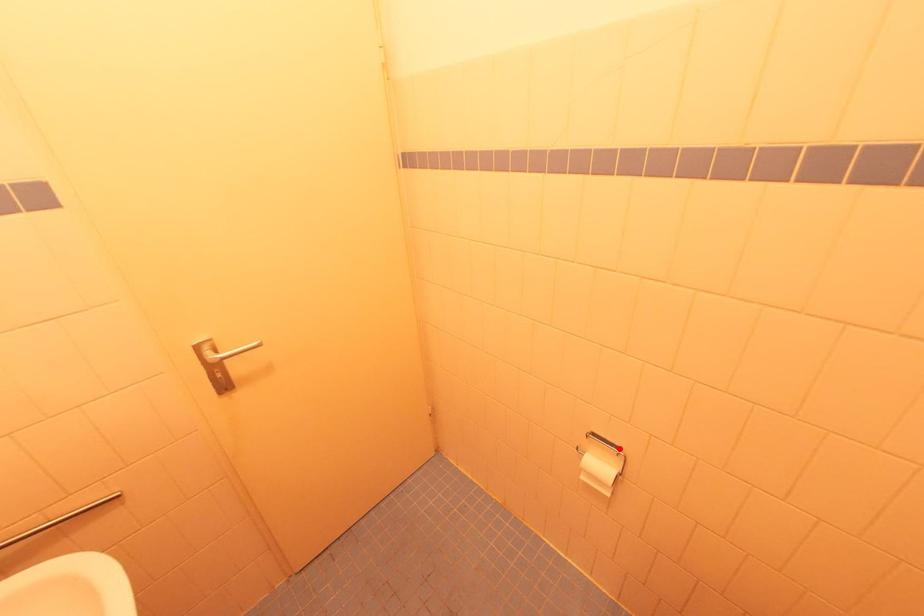
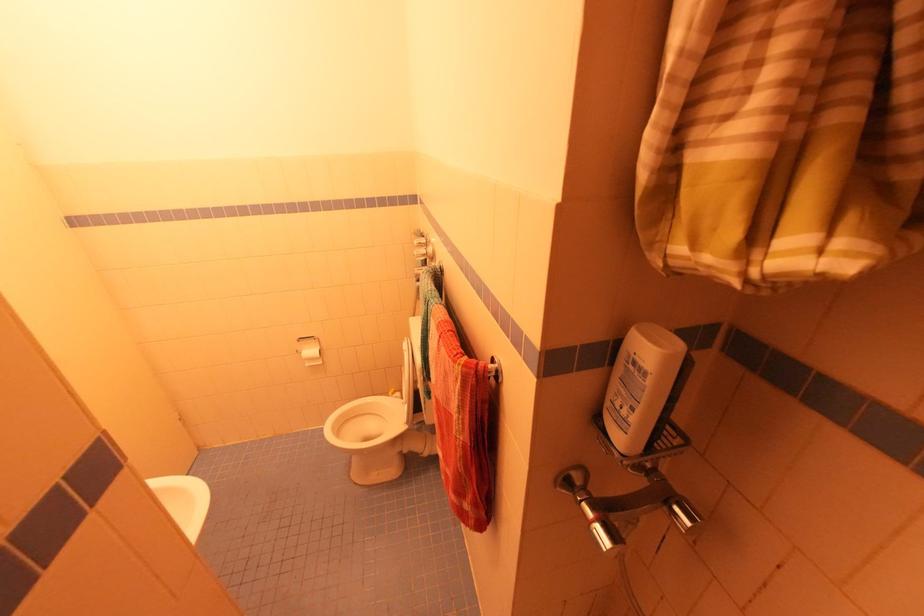
The point at the highlighted location is marked in the first image. Where is the corresponding point in the second image?

(314, 338)